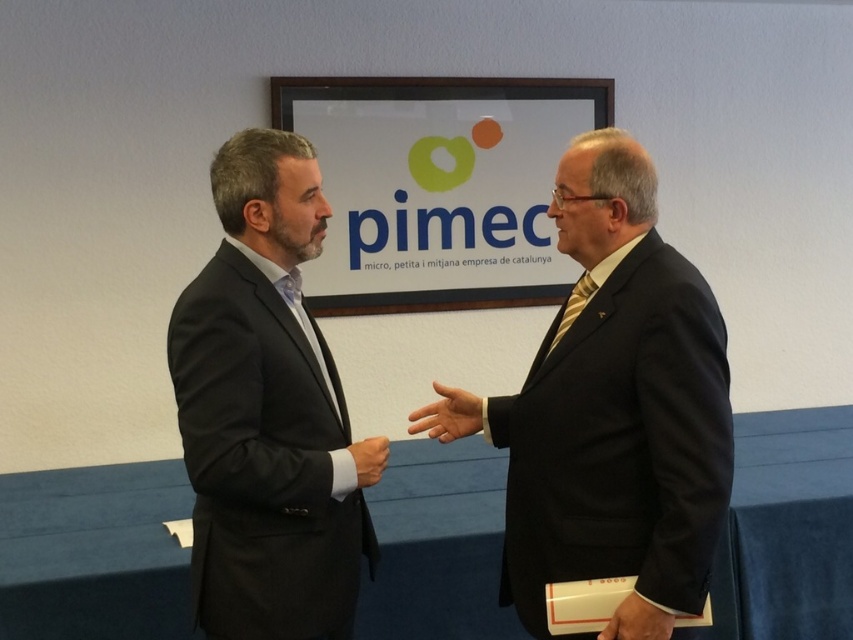
Question: Which object is farther from the camera taking this photo?

Choices:
 (A) matte black hand at center
 (B) matte black suit at left
 (C) smooth skin hand at center
 (D) matte black suit at center

Answer: (C)

Question: Among these objects, which one is farthest from the camera?

Choices:
 (A) matte black suit at left
 (B) smooth skin hand at center
 (C) matte black suit at center
 (D) smooth leather hand at center

Answer: (B)

Question: Which object is closer to the camera taking this photo?

Choices:
 (A) smooth leather hand at center
 (B) matte black suit at center
 (C) matte black suit at left

Answer: (B)

Question: Can you confirm if matte black suit at center is positioned to the right of matte black suit at left?

Choices:
 (A) no
 (B) yes

Answer: (B)

Question: From the image, what is the correct spatial relationship of matte black suit at left in relation to smooth skin hand at center?

Choices:
 (A) left
 (B) right

Answer: (A)

Question: Can you confirm if matte black suit at left is positioned to the right of matte black hand at center?

Choices:
 (A) yes
 (B) no

Answer: (B)